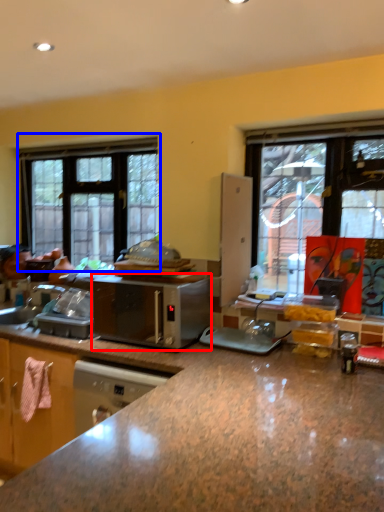
Question: Which object is further to the camera taking this photo, microwave oven (highlighted by a red box) or window (highlighted by a blue box)?

Choices:
 (A) microwave oven
 (B) window

Answer: (B)